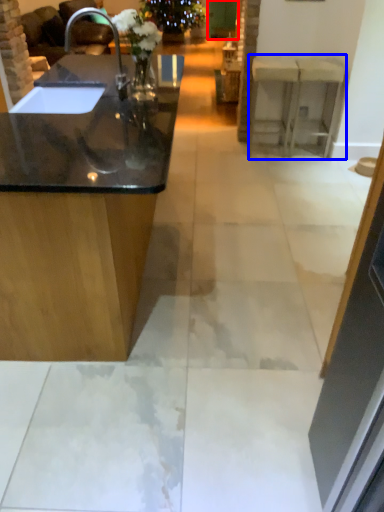
Question: Which of the following is the closest to the observer, glass door (highlighted by a red box) or counter (highlighted by a blue box)?

Choices:
 (A) glass door
 (B) counter

Answer: (B)